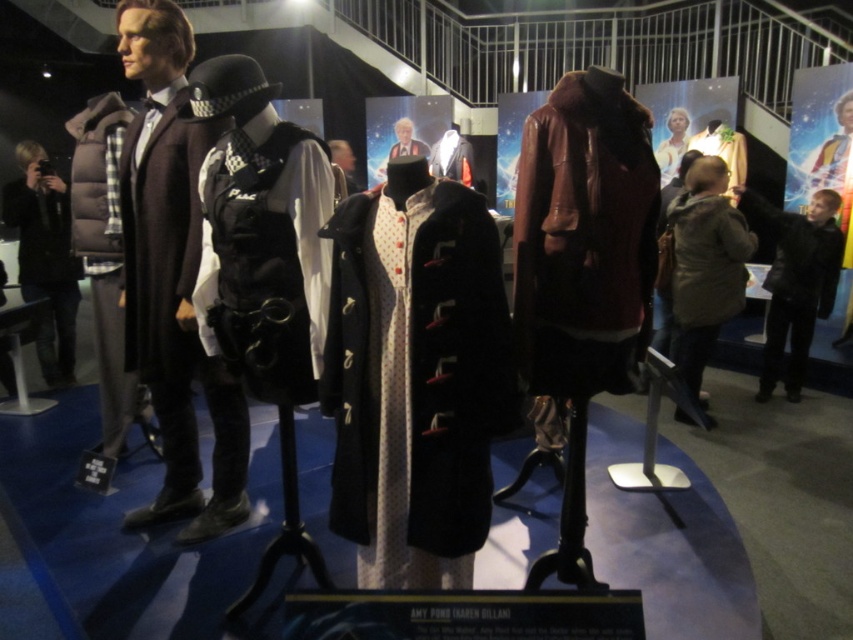
Between matte black puffer vest at left and velvet burgundy coat at center, which one is positioned higher?

velvet burgundy coat at center

Can you confirm if matte black puffer vest at left is shorter than velvet burgundy coat at center?

In fact, matte black puffer vest at left may be taller than velvet burgundy coat at center.

Image resolution: width=853 pixels, height=640 pixels. I want to click on matte black puffer vest at left, so click(103, 253).

Can you confirm if matte black uniform at center is positioned below black matte jacket at right?

Correct, matte black uniform at center is located below black matte jacket at right.

Can you confirm if matte black uniform at center is smaller than black matte jacket at right?

No.

Is point (183, 44) positioned after point (833, 296)?

No, it is in front of (833, 296).

The height and width of the screenshot is (640, 853). In order to click on matte black uniform at center in this screenshot , I will do `click(173, 276)`.

Between brown fuzzy coat at center and matte black puffer jacket at left, which one is positioned higher?

Positioned higher is matte black puffer jacket at left.

Is brown fuzzy coat at center wider than matte black puffer jacket at left?

In fact, brown fuzzy coat at center might be narrower than matte black puffer jacket at left.

Describe the element at coordinates (705, 275) in the screenshot. I see `brown fuzzy coat at center` at that location.

In order to click on brown fuzzy coat at center in this screenshot , I will do `click(705, 275)`.